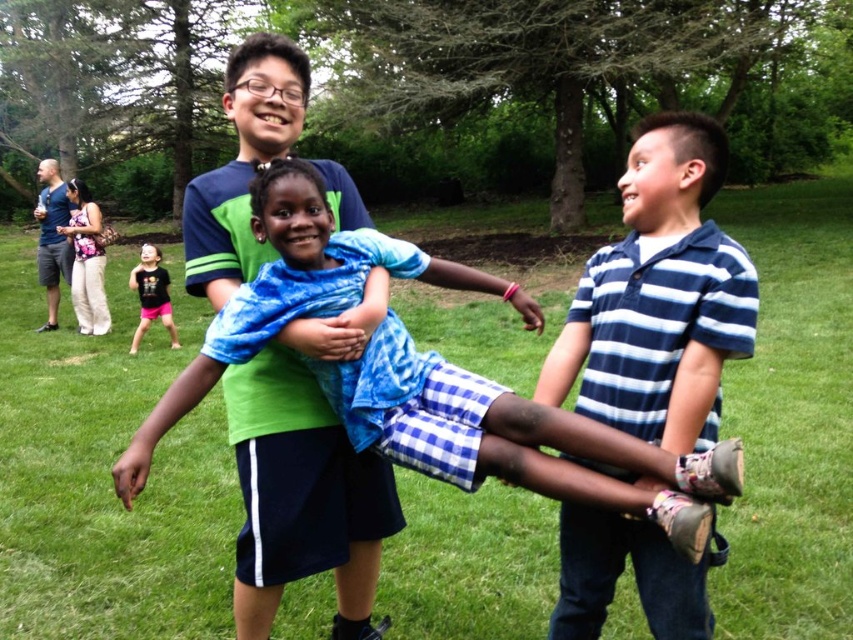
Question: Which point appears closest to the camera in this image?

Choices:
 (A) (131, 346)
 (B) (248, 273)
 (C) (39, 326)

Answer: (B)

Question: Can you confirm if blue denim shorts at left is positioned to the left of black t-shirt at lower left?

Choices:
 (A) no
 (B) yes

Answer: (B)

Question: Which object is the farthest from the blue striped shirt at center?

Choices:
 (A) blue denim shorts at left
 (B) black t-shirt at lower left
 (C) green cotton shirt at center
 (D) blue tie-dye shirt at center

Answer: (A)

Question: Can you confirm if blue tie-dye shirt at center is positioned below blue striped shirt at center?

Choices:
 (A) yes
 (B) no

Answer: (B)

Question: Can you confirm if blue tie-dye shirt at center is wider than black t-shirt at lower left?

Choices:
 (A) no
 (B) yes

Answer: (B)

Question: Which object is farther from the camera taking this photo?

Choices:
 (A) blue striped shirt at center
 (B) green cotton shirt at center
 (C) black t-shirt at lower left

Answer: (C)